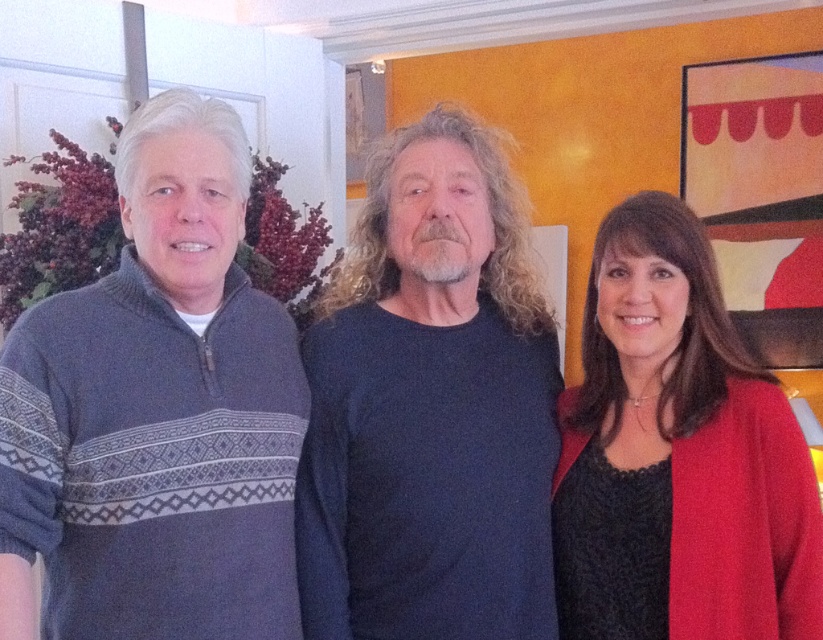
You are a fashion designer observing the three people in the scene. You need to determine which sweater is taller between the knit sweater at left and the matte red sweater at right. Which one is taller?

The knit sweater at left is taller than the matte red sweater at right.

You are a fashion designer observing the three people in the scene. You need to determine which sweater is wider between the knit sweater at left and the matte red sweater at right. Based on the scene, which one is wider?

The knit sweater at left is wider than the matte red sweater at right according to the description.